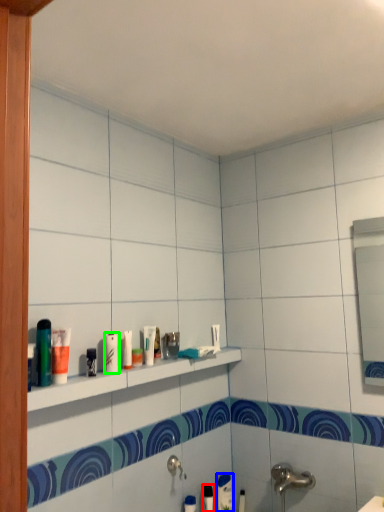
Question: Estimate the real-world distances between objects in this image. Which object is closer to toiletry (highlighted by a red box), toothpaste (highlighted by a blue box) or toiletry (highlighted by a green box)?

Choices:
 (A) toothpaste
 (B) toiletry

Answer: (A)